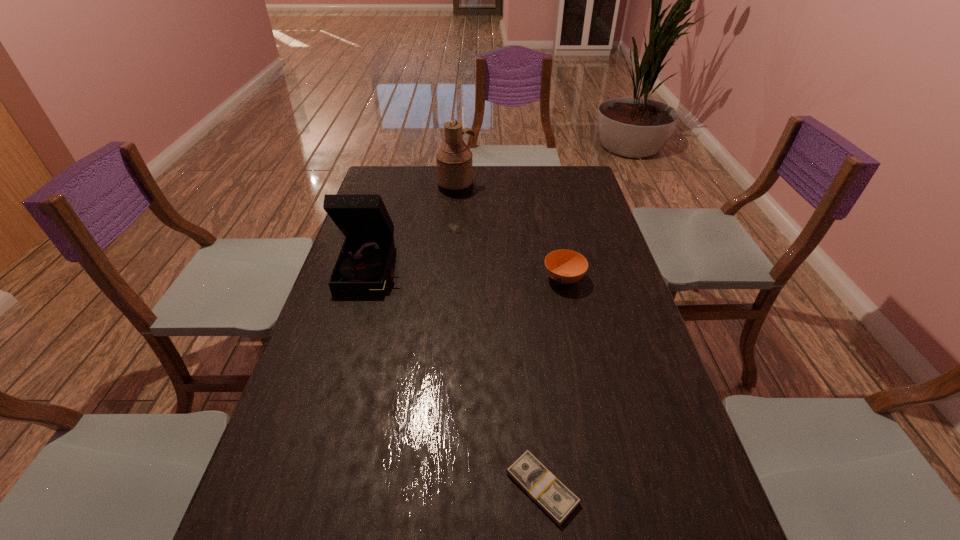
Image resolution: width=960 pixels, height=540 pixels. I want to click on pitcher, so click(454, 160).

I want to click on the farthest object, so click(x=454, y=160).

Locate an element on the screen. phonograph_record is located at coordinates (363, 266).

I want to click on the third tallest object, so click(564, 266).

Where is `the nearest object`? The width and height of the screenshot is (960, 540). the nearest object is located at coordinates (528, 472).

Identify the location of dollar. (528, 472).

Locate an element on the screen. vacant space located 0.060m on the right of the farthest object is located at coordinates (490, 187).

This screenshot has height=540, width=960. I want to click on vacant space positioned 0.190m on the front-facing side of the phonograph_record, so click(x=351, y=346).

The image size is (960, 540). What are the coordinates of `vacant region located on the back of the third tallest object` in the screenshot? It's located at (551, 218).

This screenshot has width=960, height=540. What are the coordinates of `free location located on the back of the shortest object` in the screenshot? It's located at (530, 373).